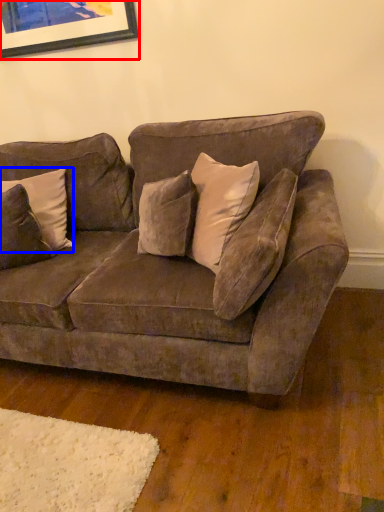
Question: Which of the following is the farthest to the observer, picture frame (highlighted by a red box) or pillow (highlighted by a blue box)?

Choices:
 (A) picture frame
 (B) pillow

Answer: (A)